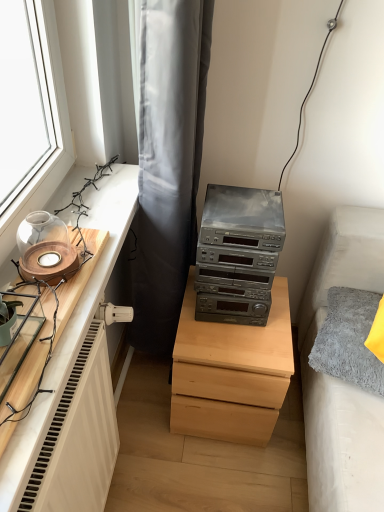
Question: From the image's perspective, is metallic gray stereo at center below gray fabric curtain at upper center?

Choices:
 (A) no
 (B) yes

Answer: (B)

Question: From a real-world perspective, is metallic gray stereo at center under gray fabric curtain at upper center?

Choices:
 (A) yes
 (B) no

Answer: (B)

Question: From the image's perspective, is metallic gray stereo at center over gray fabric curtain at upper center?

Choices:
 (A) no
 (B) yes

Answer: (A)

Question: Is metallic gray stereo at center closer to the viewer compared to gray fabric curtain at upper center?

Choices:
 (A) no
 (B) yes

Answer: (A)

Question: Is metallic gray stereo at center aimed at gray fabric curtain at upper center?

Choices:
 (A) no
 (B) yes

Answer: (A)

Question: Considering the positions of wooden tray at left and gray fabric curtain at upper center in the image, is wooden tray at left taller or shorter than gray fabric curtain at upper center?

Choices:
 (A) tall
 (B) short

Answer: (B)

Question: Relative to gray fabric curtain at upper center, is wooden tray at left in front or behind?

Choices:
 (A) behind
 (B) front

Answer: (B)

Question: From a real-world perspective, is wooden tray at left above or below gray fabric curtain at upper center?

Choices:
 (A) below
 (B) above

Answer: (B)

Question: Is wooden tray at left spatially inside gray fabric curtain at upper center, or outside of it?

Choices:
 (A) inside
 (B) outside

Answer: (B)

Question: Is light wood chest of drawers at center in front of or behind metallic gray stereo at center in the image?

Choices:
 (A) front
 (B) behind

Answer: (B)

Question: Looking at their shapes, would you say light wood chest of drawers at center is wider or thinner than metallic gray stereo at center?

Choices:
 (A) wide
 (B) thin

Answer: (A)

Question: Is light wood chest of drawers at center bigger or smaller than metallic gray stereo at center?

Choices:
 (A) small
 (B) big

Answer: (B)

Question: Is light wood chest of drawers at center taller or shorter than metallic gray stereo at center?

Choices:
 (A) short
 (B) tall

Answer: (B)

Question: From the image's perspective, is wooden tray at left positioned above or below metallic gray stereo at center?

Choices:
 (A) below
 (B) above

Answer: (A)

Question: Considering the positions of wooden tray at left and metallic gray stereo at center in the image, is wooden tray at left wider or thinner than metallic gray stereo at center?

Choices:
 (A) wide
 (B) thin

Answer: (B)